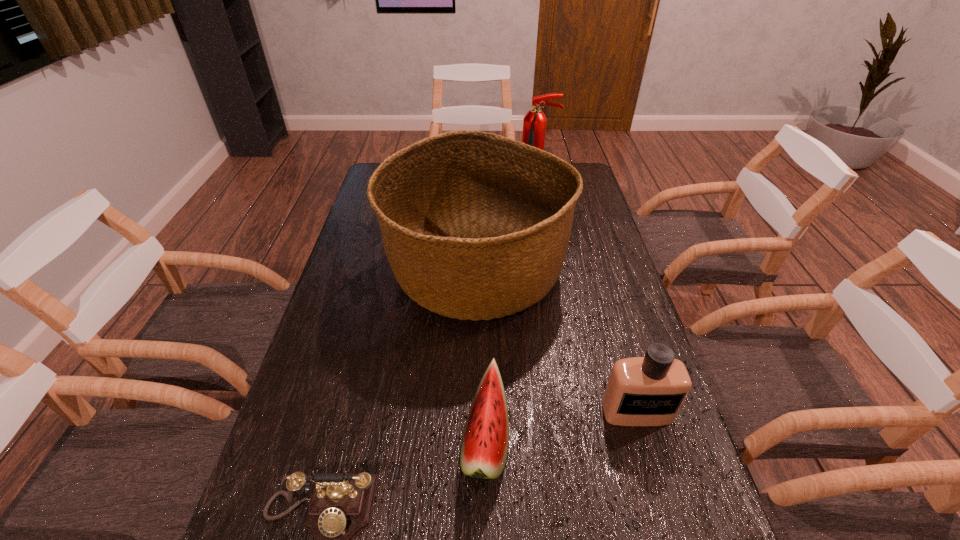
You are a GUI agent. You are given a task and a screenshot of the screen. Output one action in this format:
    pyautogui.click(x=<x>, y=<y>)
    Task: Click on the farthest object
    This screenshot has width=960, height=540.
    Given the screenshot: What is the action you would take?
    pyautogui.click(x=534, y=123)

Image resolution: width=960 pixels, height=540 pixels. I want to click on basket, so click(475, 226).

The image size is (960, 540). What are the coordinates of `the third tallest object` in the screenshot? It's located at (641, 391).

Where is `watermelon`? watermelon is located at coordinates (484, 449).

I want to click on vacant space situated at the nozzle of the farthest object, so click(544, 230).

The width and height of the screenshot is (960, 540). I want to click on vacant area situated 0.370m on the front of the basket, so click(475, 480).

Locate an element on the screen. This screenshot has height=540, width=960. blank area located on the front label of the third tallest object is located at coordinates (653, 467).

This screenshot has width=960, height=540. Identify the location of vacant space located 0.400m on the outer rind of the watermelon. (277, 440).

Locate an element on the screen. The image size is (960, 540). vacant area located 0.290m on the outer rind of the watermelon is located at coordinates (328, 440).

Identify the location of vacant region located on the outer rind of the watermelon. (388, 440).